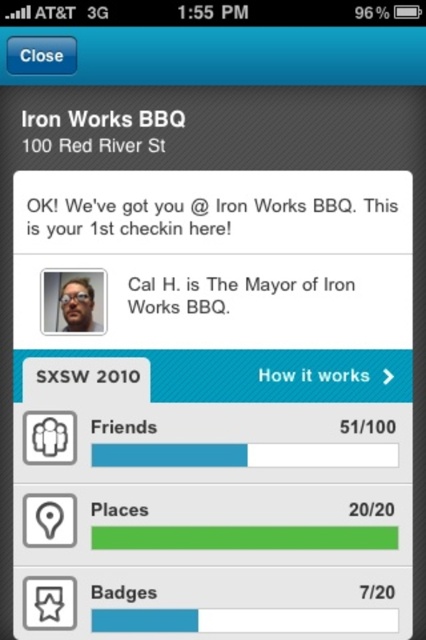
Question: Is the position of black paper text at center more distant than that of black matte text at upper center?

Choices:
 (A) no
 (B) yes

Answer: (B)

Question: Which is nearer to the black paper text at center?

Choices:
 (A) matte black glasses at upper center
 (B) white paper text at center
 (C) black matte text at upper center

Answer: (B)

Question: Does white paper text at center have a smaller size compared to matte black glasses at upper center?

Choices:
 (A) no
 (B) yes

Answer: (A)

Question: Which object is closer to the camera taking this photo?

Choices:
 (A) matte black glasses at upper center
 (B) black matte text at upper center
 (C) black paper text at center

Answer: (B)

Question: Is white paper text at center closer to the viewer compared to black matte text at upper center?

Choices:
 (A) yes
 (B) no

Answer: (B)

Question: Among these objects, which one is nearest to the camera?

Choices:
 (A) white paper text at center
 (B) matte black glasses at upper center

Answer: (A)